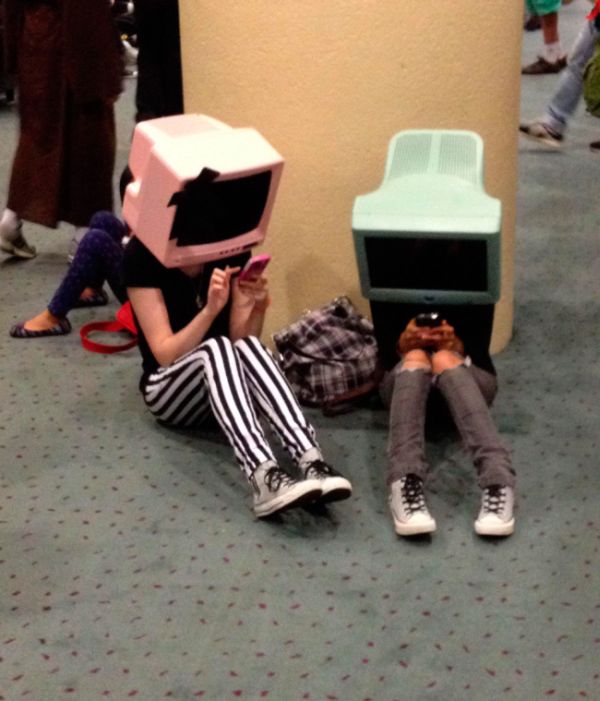
You are a GUI agent. You are given a task and a screenshot of the screen. Output one action in this format:
    pyautogui.click(x=<x>, y=<y>)
    Task: Click on the 2 monitors
    Image resolution: width=600 pixels, height=701 pixels.
    Given the screenshot: What is the action you would take?
    pyautogui.click(x=195, y=169), pyautogui.click(x=371, y=226)